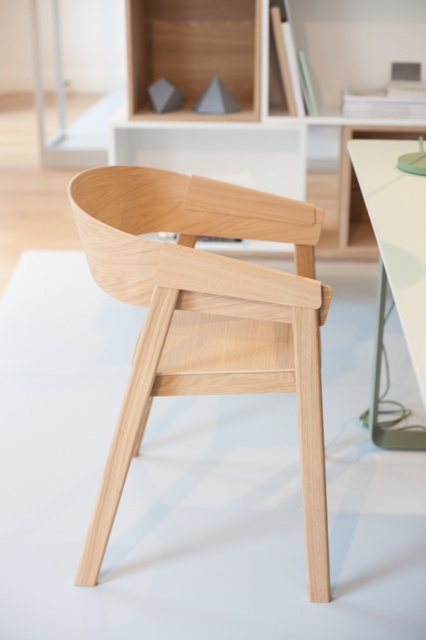
You are standing in the minimalist workspace and see the point at coordinates (206, 320). Which object is this point located on?

The point at coordinates (206, 320) is located on the natural wood chair at center.

Looking at this image, you are a furniture designer who wants to place a 1.5 meter tall sculpture on the natural wood chair at center. Can the sculpture be placed there without touching the white glossy table at right?

The natural wood chair at center is much taller than the white glossy table at right. Since the sculpture is 1.5 meters tall, placing it on the chair may cause it to extend above the chair, but since the table is shorter, it won

You are organizing a small event and need to place a 1.5 meter long tablecloth on the white glossy table at right. Considering the position of the natural wood chair at center, will the tablecloth extend past the chair on its left side?

The natural wood chair at center is positioned on the left side of white glossy table at right. Since the chair is on the left side of the table, the tablecloth placed on the table will extend past the chair on its left side.